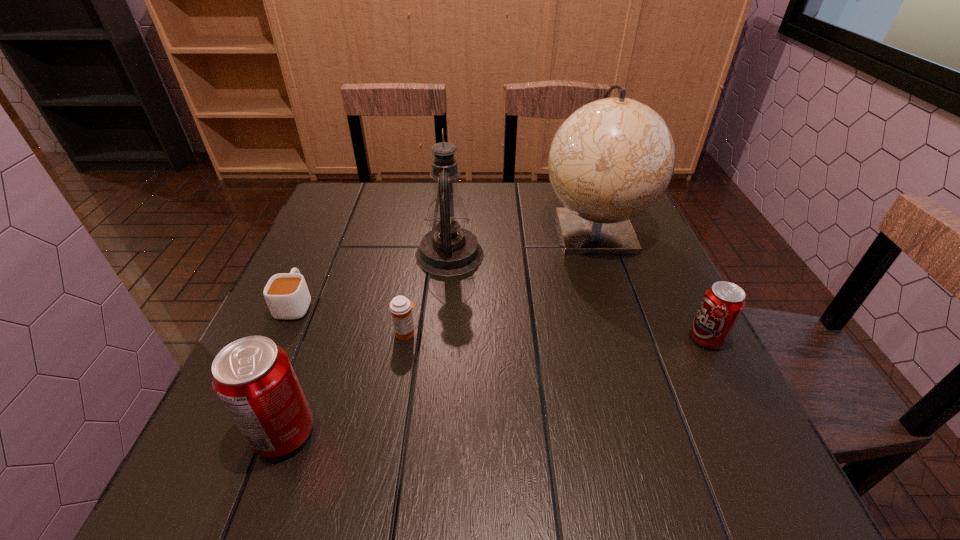
If we want them evenly spaced by inserting an extra pop_(soda) among them, please locate a free spot for this new pop_(soda). Please provide its 2D coordinates. Your answer should be formatted as a tuple, i.e. [(x, y)], where the tuple contains the x and y coordinates of a point satisfying the conditions above.

[(516, 381)]